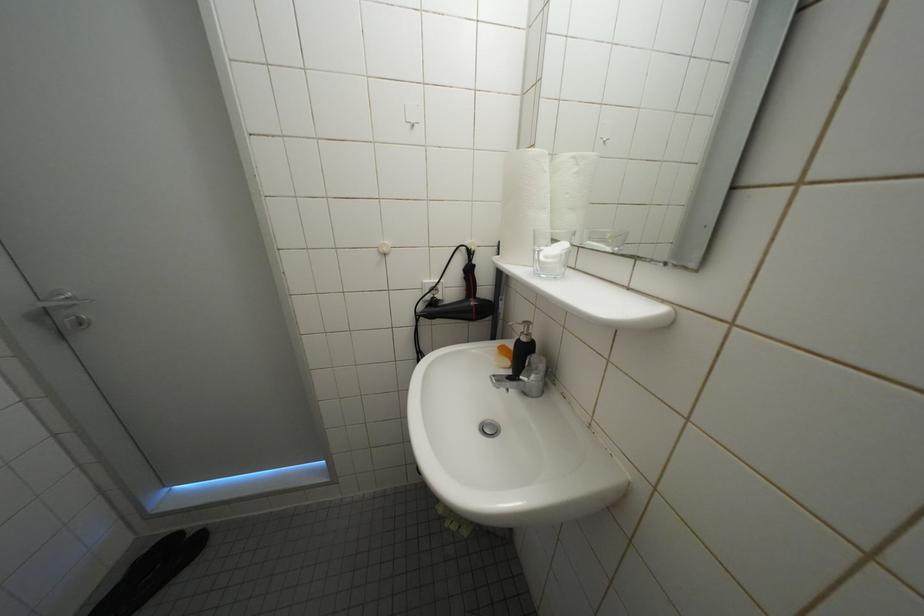
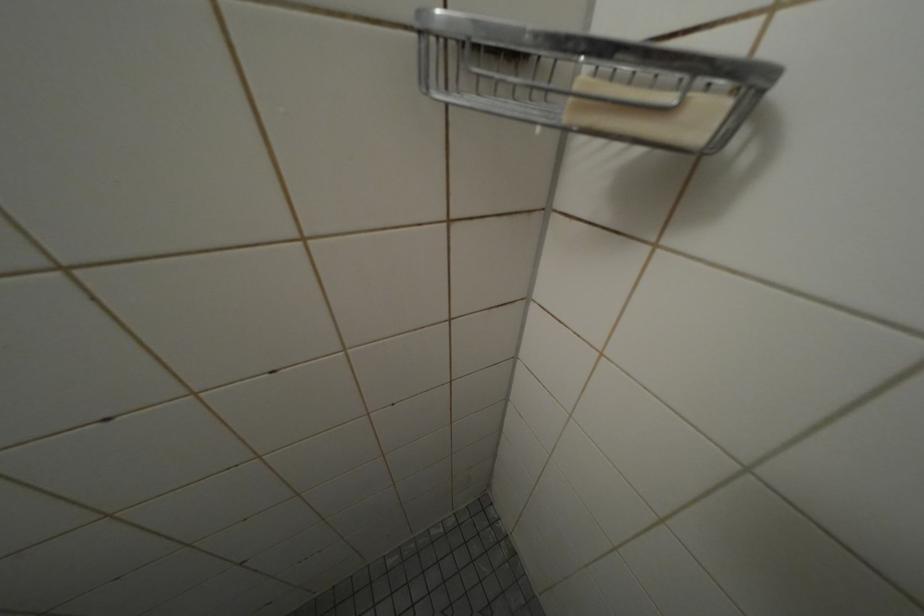
The images are taken continuously from a first-person perspective. In which direction is your viewpoint rotating?

The camera rotated toward right-down.